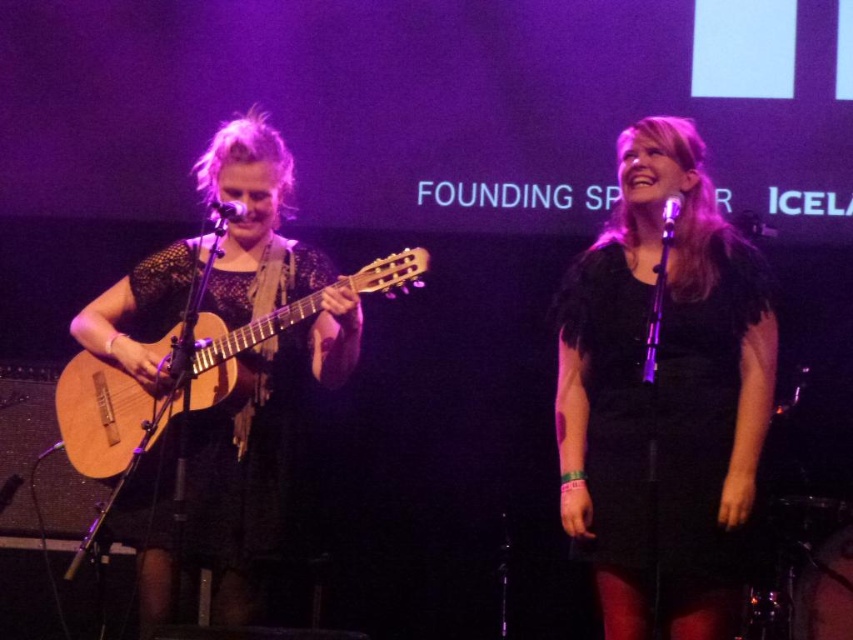
In the scene shown: Which is below, black feathered dress at center or natural wood acoustic guitar at left?

black feathered dress at center is lower down.

Who is positioned more to the left, black feathered dress at center or natural wood acoustic guitar at left?

Positioned to the left is natural wood acoustic guitar at left.

You are a GUI agent. You are given a task and a screenshot of the screen. Output one action in this format:
    pyautogui.click(x=<x>, y=<y>)
    Task: Click on the black feathered dress at center
    
    Given the screenshot: What is the action you would take?
    pyautogui.click(x=664, y=394)

Find the location of a particular element. black feathered dress at center is located at coordinates (664, 394).